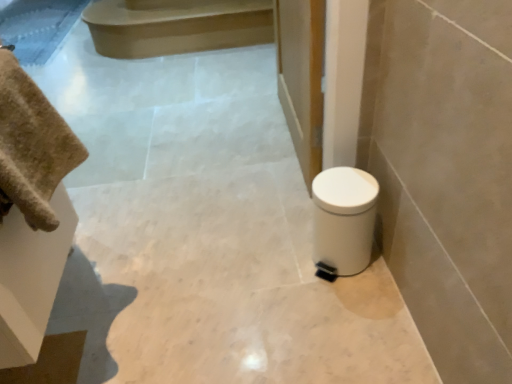
I want to click on free space in front of white plastic toilet at lower right, so click(x=348, y=312).